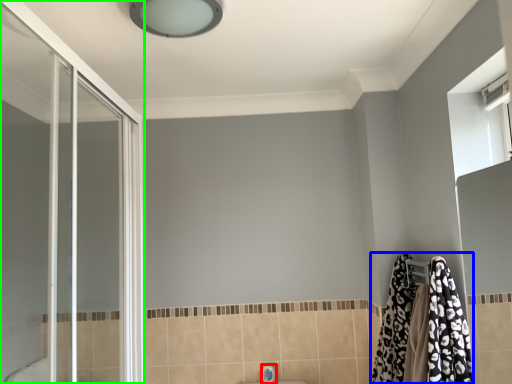
Question: Considering the real-world distances, which object is closest to faucet (highlighted by a red box)? bathrobe (highlighted by a blue box) or screen door (highlighted by a green box).

Choices:
 (A) bathrobe
 (B) screen door

Answer: (A)